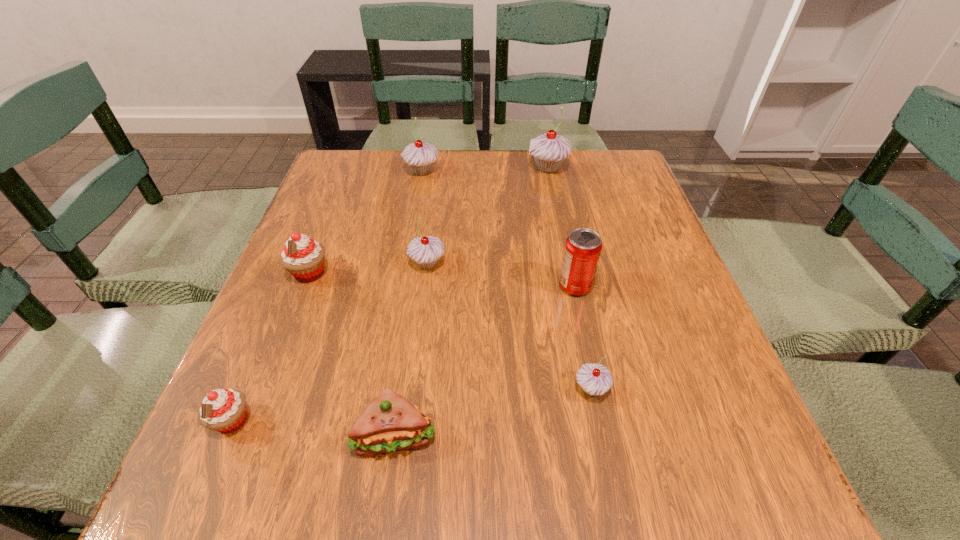
The image size is (960, 540). I want to click on free point between the sandwich and the bigger pink cupcake, so click(352, 354).

The image size is (960, 540). Identify the location of unoccupied position between the smallest gray cupcake and the sandwich. (492, 412).

Image resolution: width=960 pixels, height=540 pixels. Find the location of `the second closest object relative to the soda can`. the second closest object relative to the soda can is located at coordinates (425, 251).

Locate an element on the screen. The width and height of the screenshot is (960, 540). object identified as the closest to the sandwich is located at coordinates (224, 410).

At what (x,y) coordinates should I click in order to perform the action: click on the sixth closest cupcake relative to the sandwich. Please return your answer as a coordinate pair (x, y). The height and width of the screenshot is (540, 960). Looking at the image, I should click on (549, 150).

Locate an element on the screen. The height and width of the screenshot is (540, 960). cupcake that is the closest to the tallest object is located at coordinates (419, 156).

Locate an element on the screen. This screenshot has width=960, height=540. gray cupcake that is the third closest to the third biggest gray cupcake is located at coordinates (549, 150).

Find the location of a particular element. This screenshot has width=960, height=540. the second closest gray cupcake to the sandwich is located at coordinates (425, 251).

You are a GUI agent. You are given a task and a screenshot of the screen. Output one action in this format:
    pyautogui.click(x=<x>, y=<y>)
    Task: Click on the free point that satisfies the following two spatial constraints: 1. on the back side of the fifth shortest cupcake; 2. on the right side of the bigger pink cupcake
    
    Given the screenshot: What is the action you would take?
    pyautogui.click(x=349, y=172)

Identify the location of vacant point that satisfies the following two spatial constraints: 1. on the back side of the tallest cupcake; 2. on the left side of the sandwich. (433, 168).